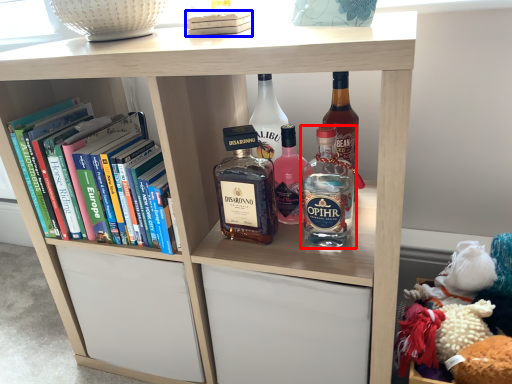
Question: Among these objects, which one is nearest to the camera, bottle (highlighted by a red box) or book (highlighted by a blue box)?

Choices:
 (A) bottle
 (B) book

Answer: (A)